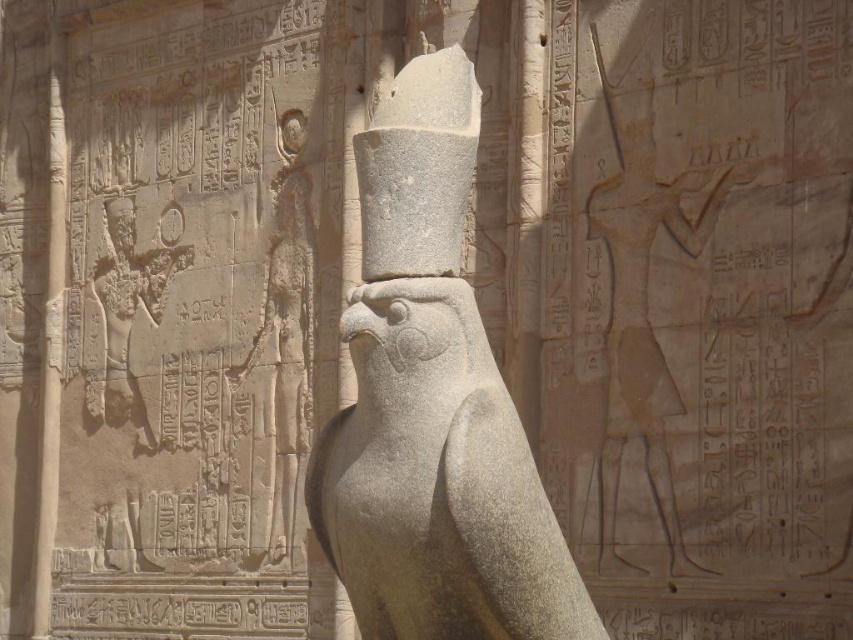
Does point (689, 172) come farther from viewer compared to point (299, 460)?

That is False.

Can you confirm if smooth stone statue at center is shorter than gray stone statue at center?

Correct, smooth stone statue at center is not as tall as gray stone statue at center.

You are a GUI agent. You are given a task and a screenshot of the screen. Output one action in this format:
    pyautogui.click(x=<x>, y=<y>)
    Task: Click on the smooth stone statue at center
    
    Given the screenshot: What is the action you would take?
    pyautogui.click(x=645, y=316)

The image size is (853, 640). Find the location of `smooth stone statue at center`. smooth stone statue at center is located at coordinates (645, 316).

Is the position of smooth stone statue at center less distant than that of matte stone pharaoh at left?

Yes.

Is smooth stone statue at center bigger than matte stone pharaoh at left?

Yes, smooth stone statue at center is bigger than matte stone pharaoh at left.

What do you see at coordinates (645, 316) in the screenshot?
I see `smooth stone statue at center` at bounding box center [645, 316].

I want to click on smooth stone statue at center, so click(x=645, y=316).

Can you confirm if gray stone bird at center is positioned above matte stone pharaoh at left?

Actually, gray stone bird at center is below matte stone pharaoh at left.

Is point (344, 481) more distant than point (103, 205)?

No, (344, 481) is closer to viewer.

Where is `gray stone bird at center`? The height and width of the screenshot is (640, 853). gray stone bird at center is located at coordinates (432, 404).

Identify the location of gray stone bird at center. (432, 404).